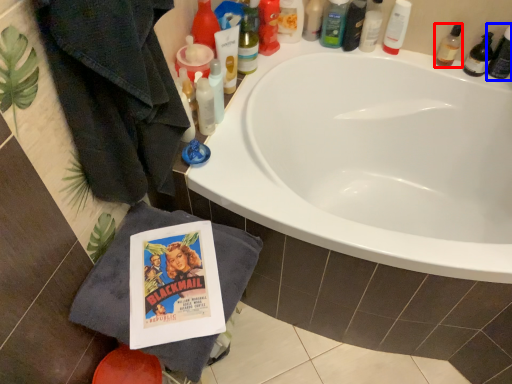
Question: Which object is closer to the camera taking this photo, toiletry (highlighted by a red box) or toiletry (highlighted by a blue box)?

Choices:
 (A) toiletry
 (B) toiletry

Answer: (B)